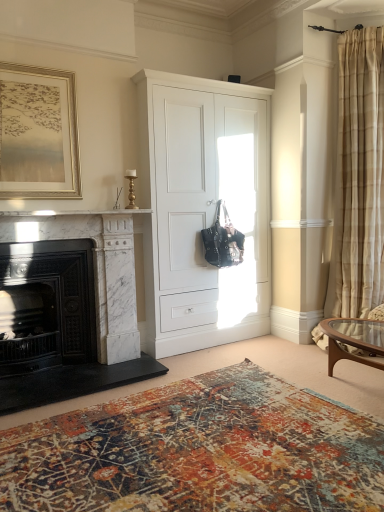
Question: Is white marble fireplace at left, the 1th fireplace viewed from the right, spatially inside white matte cabinet at center, or outside of it?

Choices:
 (A) inside
 (B) outside

Answer: (B)

Question: In the image, is white marble fireplace at left, arranged as the second fireplace when viewed from the left, positioned in front of or behind white matte cabinet at center?

Choices:
 (A) behind
 (B) front

Answer: (B)

Question: Considering the real-world distances, which object is farthest from the gold metallic picture frame at upper left?

Choices:
 (A) beige textured curtain at right
 (B) white marble fireplace at left, arranged as the second fireplace when viewed from the left
 (C) white marble fireplace at left
 (D) white matte cabinet at center
 (E) black marble fireplace at left, the 1th fireplace viewed from the left

Answer: (A)

Question: Which of these objects is positioned farthest from the white marble fireplace at left, arranged as the second fireplace when viewed from the left?

Choices:
 (A) black marble fireplace at left, the 1th fireplace viewed from the left
 (B) gold metallic picture frame at upper left
 (C) white matte cabinet at center
 (D) beige textured curtain at right
 (E) textured rug at lower center

Answer: (D)